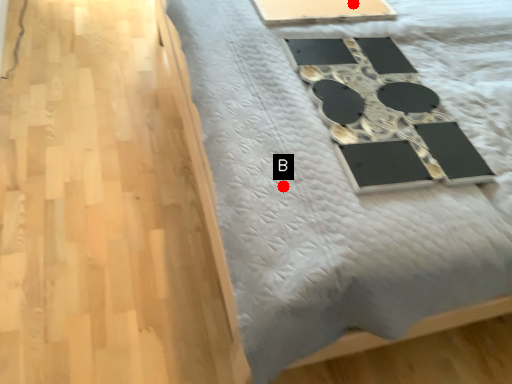
Question: Two points are circled on the image, labeled by A and B beside each circle. Which point is closer to the camera taking this photo?

Choices:
 (A) A is closer
 (B) B is closer

Answer: (B)